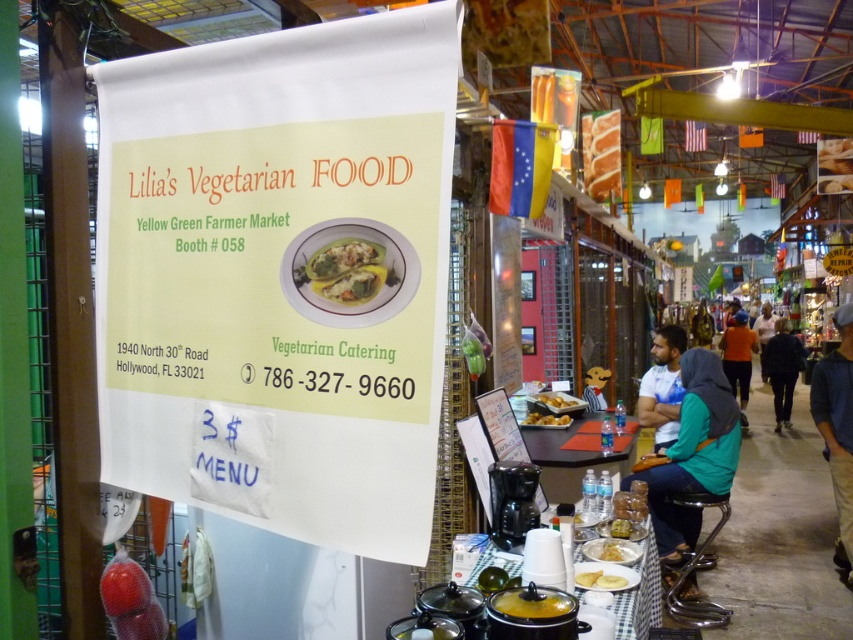
What are the coordinates of `shiny chrome stool at lower right` in the screenshot? It's located at (694, 566).

Is point (721, 513) positioned before point (613, 582)?

No, (721, 513) is further to viewer.

This screenshot has height=640, width=853. Identify the location of shiny chrome stool at lower right. (694, 566).

At what (x,y) coordinates should I click in order to perform the action: click on shiny chrome stool at lower right. Please return your answer as a coordinate pair (x, y). Image resolution: width=853 pixels, height=640 pixels. Looking at the image, I should click on (694, 566).

Is green matte vegetable at center positioned before yellow matte plate at center?

Yes, green matte vegetable at center is in front of yellow matte plate at center.

Can you confirm if green matte vegetable at center is wider than yellow matte plate at center?

No, green matte vegetable at center is not wider than yellow matte plate at center.

This screenshot has height=640, width=853. I want to click on green matte vegetable at center, so click(x=344, y=272).

Can you confirm if teal fabric hijab at lower right is shorter than golden brown crispy pastry at lower center?

Incorrect, teal fabric hijab at lower right's height does not fall short of golden brown crispy pastry at lower center's.

Between teal fabric hijab at lower right and golden brown crispy pastry at lower center, which one is positioned higher?

teal fabric hijab at lower right

Where is `teal fabric hijab at lower right`? Image resolution: width=853 pixels, height=640 pixels. teal fabric hijab at lower right is located at coordinates [692, 454].